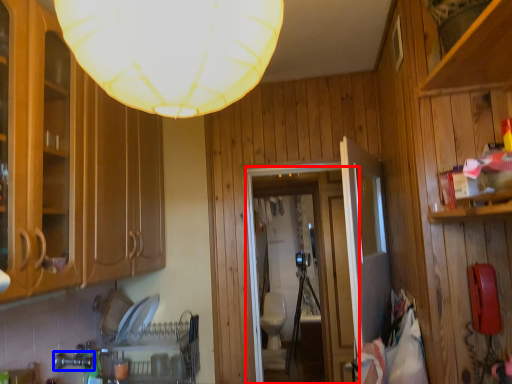
Question: Which object is further to the camera taking this photo, glass door (highlighted by a red box) or faucet (highlighted by a blue box)?

Choices:
 (A) glass door
 (B) faucet

Answer: (A)